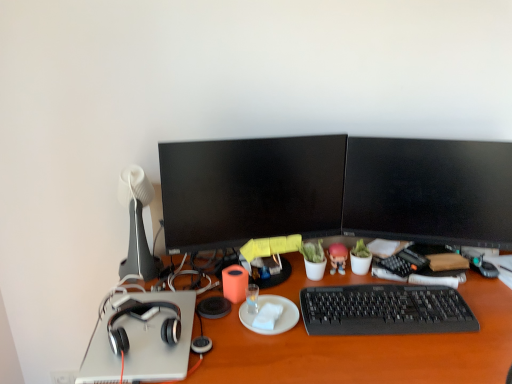
At what (x,y) coordinates should I click in order to perform the action: click on vacant area that lies in front of orange matte cup at center. Please return your answer as a coordinate pair (x, y). This screenshot has height=384, width=512. Looking at the image, I should click on (237, 337).